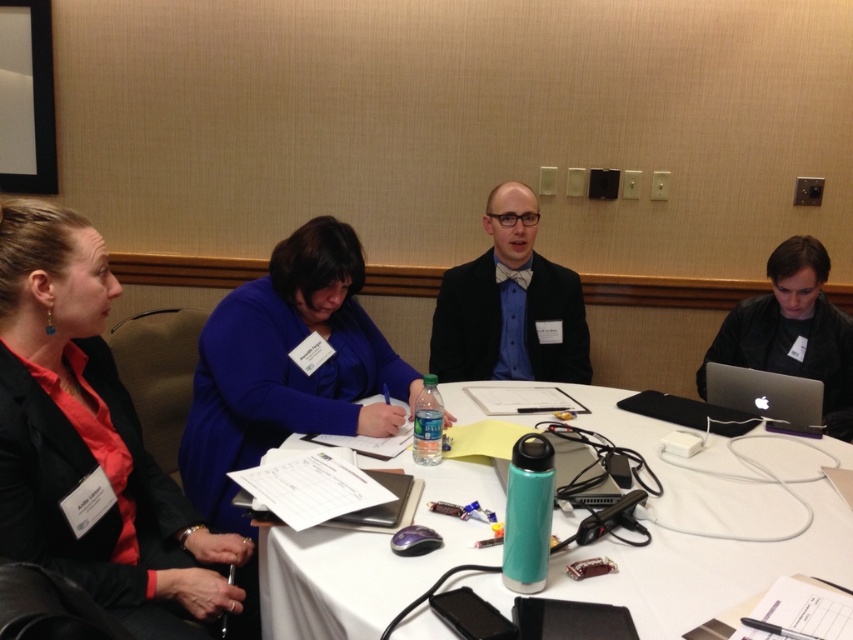
Which is in front, point (357, 320) or point (834, 388)?

Point (357, 320) is in front.

Does blue fabric dress at center have a smaller size compared to black matte laptop at right?

Incorrect, blue fabric dress at center is not smaller in size than black matte laptop at right.

The height and width of the screenshot is (640, 853). What are the coordinates of `blue fabric dress at center` in the screenshot? It's located at (286, 365).

From the picture: Who is more distant from viewer, [817,483] or [96,288]?

The point [817,483] is behind.

Is teal plastic water bottle at center below matte black blazer at left?

Yes.

Is point (647, 618) behind point (78, 273)?

No, (647, 618) is closer to viewer.

Find the location of `teal plastic water bottle at center`. teal plastic water bottle at center is located at coordinates (368, 561).

Between black matte laptop at right and silver metallic laptop at lower right, which one is positioned lower?

silver metallic laptop at lower right is lower down.

Can you confirm if black matte laptop at right is bigger than silver metallic laptop at lower right?

Indeed, black matte laptop at right has a larger size compared to silver metallic laptop at lower right.

Find the location of `black matte laptop at right`. black matte laptop at right is located at coordinates (792, 332).